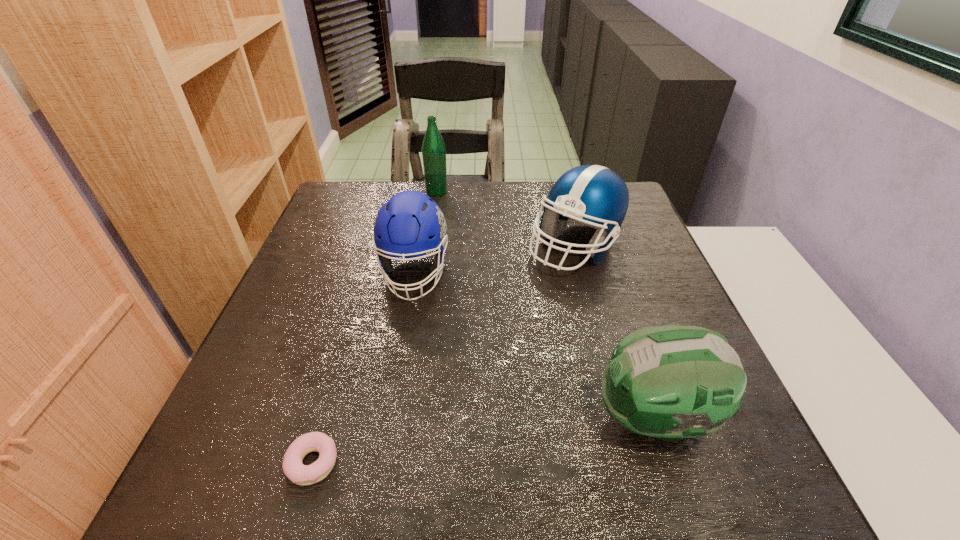
In order to click on bottle in this screenshot , I will do `click(433, 147)`.

Locate an element on the screen. the leftmost football helmet is located at coordinates (410, 224).

The width and height of the screenshot is (960, 540). I want to click on the nearest football helmet, so click(x=671, y=382).

At what (x,y) coordinates should I click in order to perform the action: click on the shortest object. Please return your answer as a coordinate pair (x, y). Looking at the image, I should click on tap(300, 474).

The image size is (960, 540). Identify the location of vacant space located 0.310m on the front of the farthest object. (426, 262).

Find the location of a particular element. vacant space located 0.210m on the face guard of the leftmost football helmet is located at coordinates (395, 387).

Image resolution: width=960 pixels, height=540 pixels. In order to click on vacant region located 0.370m on the visor of the nearest football helmet in this screenshot , I will do `click(383, 417)`.

Locate an element on the screen. free location located on the visor of the nearest football helmet is located at coordinates (543, 417).

Locate an element on the screen. This screenshot has height=540, width=960. vacant space situated on the visor of the nearest football helmet is located at coordinates (452, 417).

At what (x,y) coordinates should I click in order to perform the action: click on vacant space located 0.050m on the back of the shortest object. Please return your answer as a coordinate pair (x, y). Looking at the image, I should click on (327, 412).